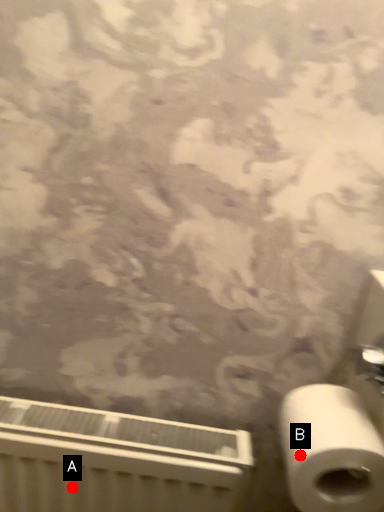
Question: Two points are circled on the image, labeled by A and B beside each circle. Which point is closer to the camera?

Choices:
 (A) A is closer
 (B) B is closer

Answer: (B)